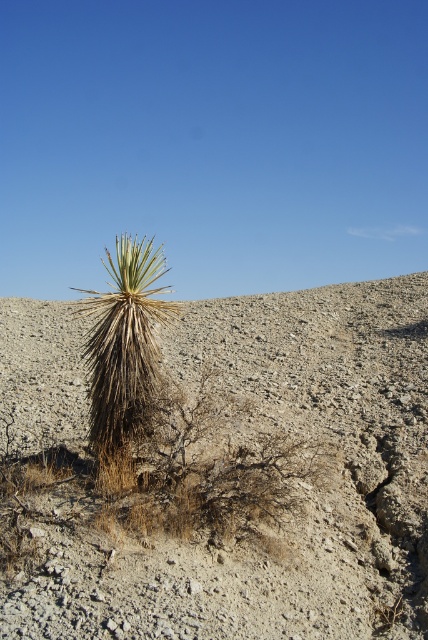
Is brown/dry soil at center to the left of brown/dry grass at center from the viewer's perspective?

Yes, brown/dry soil at center is to the left of brown/dry grass at center.

How much distance is there between brown/dry soil at center and brown/dry grass at center?

brown/dry soil at center and brown/dry grass at center are 1.34 meters apart.

At what (x,y) coordinates should I click in order to perform the action: click on brown/dry soil at center. Please return your answer as a coordinate pair (x, y). The width and height of the screenshot is (428, 640). Looking at the image, I should click on (297, 486).